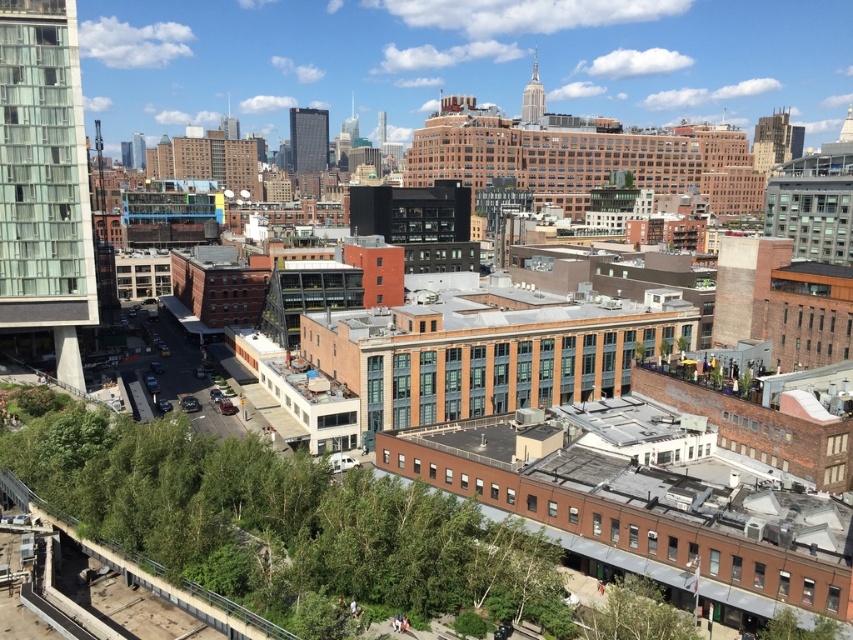
Is point (312, 150) positioned behind point (531, 108)?

Yes, it is behind point (531, 108).

Does glassy reflective skyscraper at center have a greater width compared to matte glass skyscraper at upper center?

Incorrect, glassy reflective skyscraper at center's width does not surpass matte glass skyscraper at upper center's.

Between point (318, 161) and point (535, 96), which one is positioned in front?

Point (535, 96)

The width and height of the screenshot is (853, 640). I want to click on glassy reflective skyscraper at center, so click(308, 140).

Does point (759, 157) come behind point (531, 76)?

No, it is not.

Does point (753, 136) lie in front of point (538, 100)?

That is True.

Is point (793, 131) farther from camera compared to point (526, 99)?

No, it is in front of (526, 99).

Locate an element on the screen. This screenshot has height=640, width=853. matte brown building at upper right is located at coordinates pos(775,140).

Measure the distance between point (x=677, y=612) and camera.

Point (x=677, y=612) and camera are 64.37 meters apart from each other.

Is green leafy tree at lower center smaller than glassy reflective skyscraper at center?

Correct, green leafy tree at lower center occupies less space than glassy reflective skyscraper at center.

Describe the element at coordinates (636, 612) in the screenshot. I see `green leafy tree at lower center` at that location.

This screenshot has width=853, height=640. I want to click on green leafy tree at lower center, so click(636, 612).